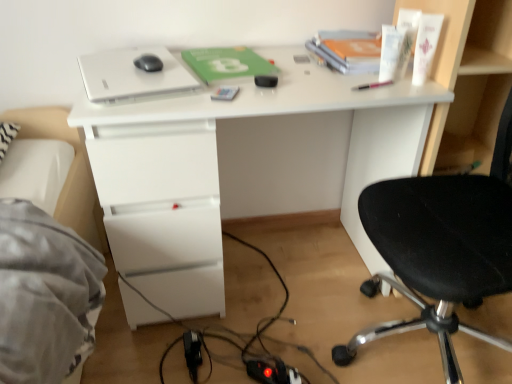
Locate an element on the screen. This screenshot has height=384, width=512. vacant area that lies between white matte book at upper right and green matte paperback book at center is located at coordinates (291, 61).